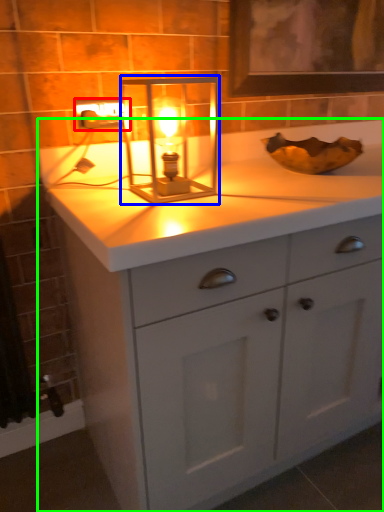
Question: Based on their relative distances, which object is nearer to electric outlet (highlighted by a red box)? Choose from candle holder (highlighted by a blue box) and bathroom cabinet (highlighted by a green box).

Choices:
 (A) candle holder
 (B) bathroom cabinet

Answer: (A)